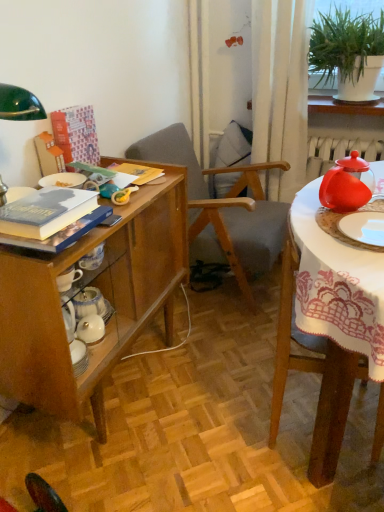
This screenshot has height=512, width=384. What are the coordinates of `vacant space underneath wooden chair at right, the 1th chair positioned from the front (from a real-world perspective)` in the screenshot? It's located at (305, 463).